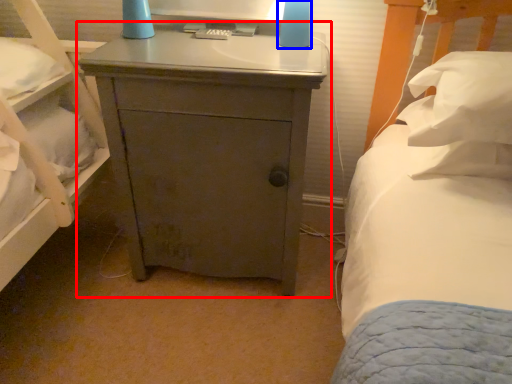
Question: Which object appears farthest to the camera in this image, nightstand (highlighted by a red box) or bedside lamp (highlighted by a blue box)?

Choices:
 (A) nightstand
 (B) bedside lamp

Answer: (B)